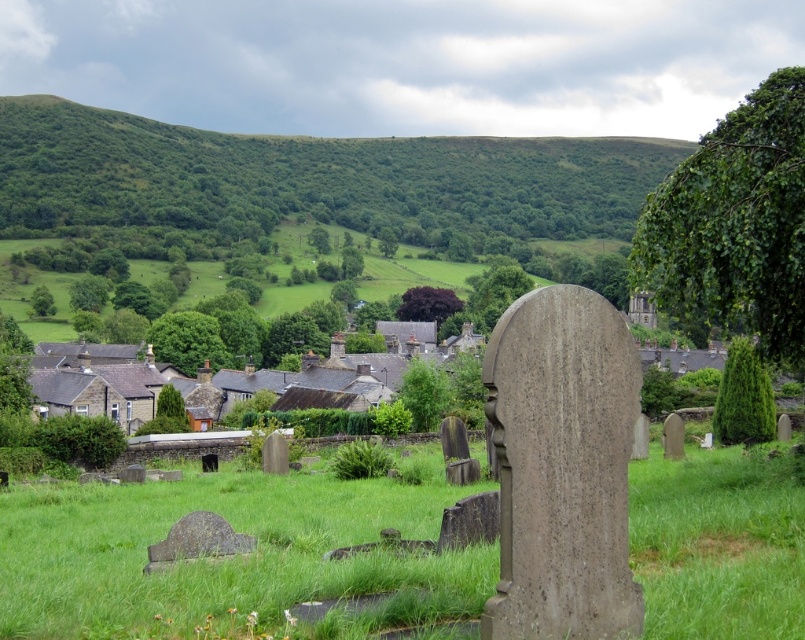
You are standing in the cemetery looking towards the hills. Which object is closer to you, the green leafy hillside at upper center or the purple leafy tree at center?

The green leafy hillside at upper center is closer to you because it is further to the viewer than the purple leafy tree at center.